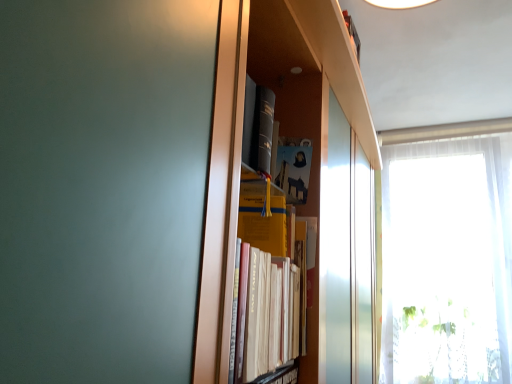
Where is `yellow matte paper at center, the 2th paperback book from the bottom`? This screenshot has height=384, width=512. yellow matte paper at center, the 2th paperback book from the bottom is located at coordinates (293, 168).

Image resolution: width=512 pixels, height=384 pixels. I want to click on yellow paper at center, acting as the 2th paperback book starting from the top, so click(262, 218).

In order to click on yellow matte paper at center, the 1th paperback book positioned from the top in this screenshot , I will do `click(293, 168)`.

Based on the photo, is yellow paper at center, acting as the 2th paperback book starting from the top, not near yellow matte paper at center, the 1th paperback book positioned from the top?

yellow paper at center, acting as the 2th paperback book starting from the top, is actually quite close to yellow matte paper at center, the 1th paperback book positioned from the top.

In the scene shown: Who is bigger, yellow paper at center, acting as the 2th paperback book starting from the top, or yellow matte paper at center, the 1th paperback book positioned from the top?

yellow paper at center, acting as the 2th paperback book starting from the top.

Based on the photo, which object is more forward, yellow paper at center, acting as the 2th paperback book starting from the top, or yellow matte paper at center, the 2th paperback book from the bottom?

yellow paper at center, acting as the 2th paperback book starting from the top, is more forward.

Which object is thinner, yellow paper at center, which appears as the 1th paperback book when ordered from the bottom, or yellow matte paper at center, the 2th paperback book from the bottom?

Thinner between the two is yellow matte paper at center, the 2th paperback book from the bottom.

From the image's perspective, does yellow matte paper at center, the 1th paperback book positioned from the top, appear lower than yellow paper at center, acting as the 2th paperback book starting from the top?

No, from the image's perspective, yellow matte paper at center, the 1th paperback book positioned from the top, is not below yellow paper at center, acting as the 2th paperback book starting from the top.

Is there a large distance between yellow matte paper at center, the 1th paperback book positioned from the top, and yellow paper at center, acting as the 2th paperback book starting from the top?

No, yellow matte paper at center, the 1th paperback book positioned from the top, is not far away from yellow paper at center, acting as the 2th paperback book starting from the top.

Does yellow matte paper at center, the 2th paperback book from the bottom, contain yellow paper at center, acting as the 2th paperback book starting from the top?

No, yellow paper at center, acting as the 2th paperback book starting from the top, is not a part of yellow matte paper at center, the 2th paperback book from the bottom.

How distant is yellow matte paper at center, the 1th paperback book positioned from the top, from yellow paper at center, which appears as the 1th paperback book when ordered from the bottom?

3.99 inches.

From a real-world perspective, is white sheer curtain at right physically located above or below yellow paper at center, which appears as the 1th paperback book when ordered from the bottom?

In terms of real-world spatial position, white sheer curtain at right is above yellow paper at center, which appears as the 1th paperback book when ordered from the bottom.

How far apart are white sheer curtain at right and yellow paper at center, acting as the 2th paperback book starting from the top?

A distance of 5.26 feet exists between white sheer curtain at right and yellow paper at center, acting as the 2th paperback book starting from the top.

Who is bigger, white sheer curtain at right or yellow paper at center, which appears as the 1th paperback book when ordered from the bottom?

white sheer curtain at right.

How many degrees apart are the facing directions of white sheer curtain at right and yellow paper at center, acting as the 2th paperback book starting from the top?

The facing directions of white sheer curtain at right and yellow paper at center, acting as the 2th paperback book starting from the top, are 7.38 degrees apart.

Based on the photo, considering the sizes of objects yellow paper at center, which appears as the 1th paperback book when ordered from the bottom, and white sheer curtain at right in the image provided, who is thinner, yellow paper at center, which appears as the 1th paperback book when ordered from the bottom, or white sheer curtain at right?

yellow paper at center, which appears as the 1th paperback book when ordered from the bottom.

From the picture: Considering the sizes of objects yellow paper at center, acting as the 2th paperback book starting from the top, and white sheer curtain at right in the image provided, who is smaller, yellow paper at center, acting as the 2th paperback book starting from the top, or white sheer curtain at right?

yellow paper at center, acting as the 2th paperback book starting from the top.

From the image's perspective, is yellow paper at center, acting as the 2th paperback book starting from the top, above or below white sheer curtain at right?

yellow paper at center, acting as the 2th paperback book starting from the top, is above white sheer curtain at right.

Which is more to the left, white sheer curtain at right or yellow matte paper at center, the 2th paperback book from the bottom?

yellow matte paper at center, the 2th paperback book from the bottom.

Is yellow matte paper at center, the 1th paperback book positioned from the top, completely or partially inside white sheer curtain at right?

That's incorrect, yellow matte paper at center, the 1th paperback book positioned from the top, is not inside white sheer curtain at right.

Considering the positions of objects white sheer curtain at right and yellow matte paper at center, the 1th paperback book positioned from the top, in the image provided, who is behind, white sheer curtain at right or yellow matte paper at center, the 1th paperback book positioned from the top,?

Positioned behind is white sheer curtain at right.

Is white sheer curtain at right not near yellow matte paper at center, the 1th paperback book positioned from the top?

Absolutely, white sheer curtain at right is distant from yellow matte paper at center, the 1th paperback book positioned from the top.

Is white sheer curtain at right surrounded by yellow matte paper at center, the 1th paperback book positioned from the top?

No, white sheer curtain at right is not a part of yellow matte paper at center, the 1th paperback book positioned from the top.

From the image's perspective, is yellow matte paper at center, the 2th paperback book from the bottom, beneath white sheer curtain at right?

No, from the image's perspective, yellow matte paper at center, the 2th paperback book from the bottom, is not below white sheer curtain at right.

Between yellow matte paper at center, the 2th paperback book from the bottom, and white sheer curtain at right, which one has smaller size?

yellow matte paper at center, the 2th paperback book from the bottom, is smaller.

Locate an element on the screen. The height and width of the screenshot is (384, 512). paperback book below the yellow matte paper at center, the 2th paperback book from the bottom (from a real-world perspective) is located at coordinates (262, 218).

At what (x,y) coordinates should I click in order to perform the action: click on paperback book that appears behind the yellow paper at center, acting as the 2th paperback book starting from the top. Please return your answer as a coordinate pair (x, y). This screenshot has height=384, width=512. Looking at the image, I should click on (293, 168).

When comparing their distances from yellow paper at center, acting as the 2th paperback book starting from the top, does yellow matte paper at center, the 2th paperback book from the bottom, or white sheer curtain at right seem closer?

yellow matte paper at center, the 2th paperback book from the bottom, lies closer to yellow paper at center, acting as the 2th paperback book starting from the top, than the other object.

Which object lies nearer to the anchor point white sheer curtain at right, yellow paper at center, acting as the 2th paperback book starting from the top, or yellow matte paper at center, the 2th paperback book from the bottom?

The object closer to white sheer curtain at right is yellow matte paper at center, the 2th paperback book from the bottom.

In the scene shown: Estimate the real-world distances between objects in this image. Which object is further from white sheer curtain at right, yellow matte paper at center, the 1th paperback book positioned from the top, or yellow paper at center, acting as the 2th paperback book starting from the top?

yellow paper at center, acting as the 2th paperback book starting from the top, lies further to white sheer curtain at right than the other object.

From the image, which object appears to be nearer to yellow paper at center, which appears as the 1th paperback book when ordered from the bottom, white sheer curtain at right or yellow matte paper at center, the 2th paperback book from the bottom?

Among the two, yellow matte paper at center, the 2th paperback book from the bottom, is located nearer to yellow paper at center, which appears as the 1th paperback book when ordered from the bottom.

When comparing their distances from yellow matte paper at center, the 2th paperback book from the bottom, does yellow paper at center, which appears as the 1th paperback book when ordered from the bottom, or white sheer curtain at right seem further?

white sheer curtain at right is further to yellow matte paper at center, the 2th paperback book from the bottom.

Considering their positions, is white sheer curtain at right positioned further to yellow matte paper at center, the 1th paperback book positioned from the top, than yellow paper at center, which appears as the 1th paperback book when ordered from the bottom?

white sheer curtain at right is positioned further to the anchor yellow matte paper at center, the 1th paperback book positioned from the top.

In order to click on paperback book situated between yellow paper at center, which appears as the 1th paperback book when ordered from the bottom, and white sheer curtain at right from left to right in this screenshot , I will do `click(293, 168)`.